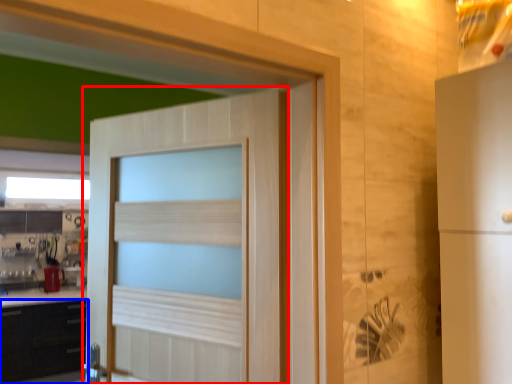
Question: Among these objects, which one is farthest to the camera, door (highlighted by a red box) or cabinetry (highlighted by a blue box)?

Choices:
 (A) door
 (B) cabinetry

Answer: (B)